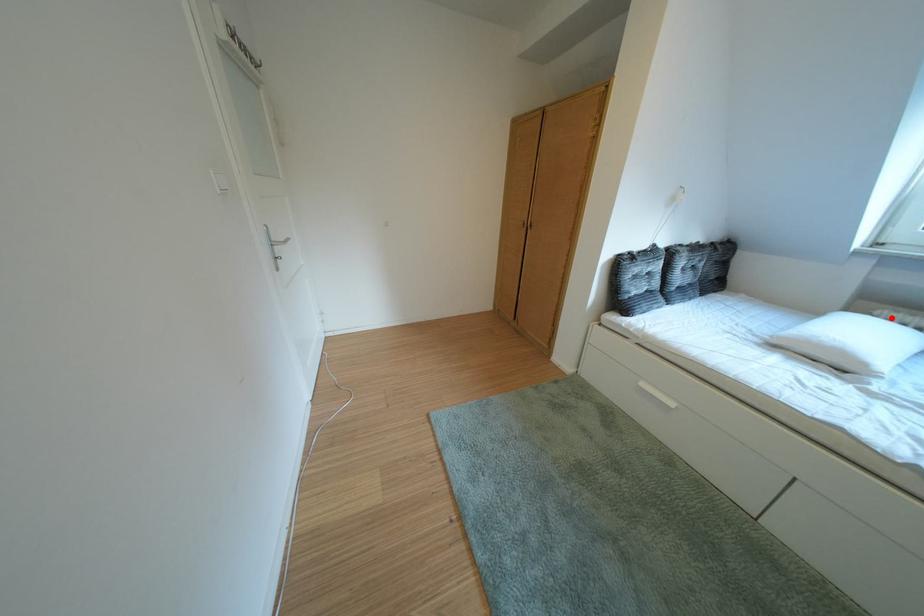
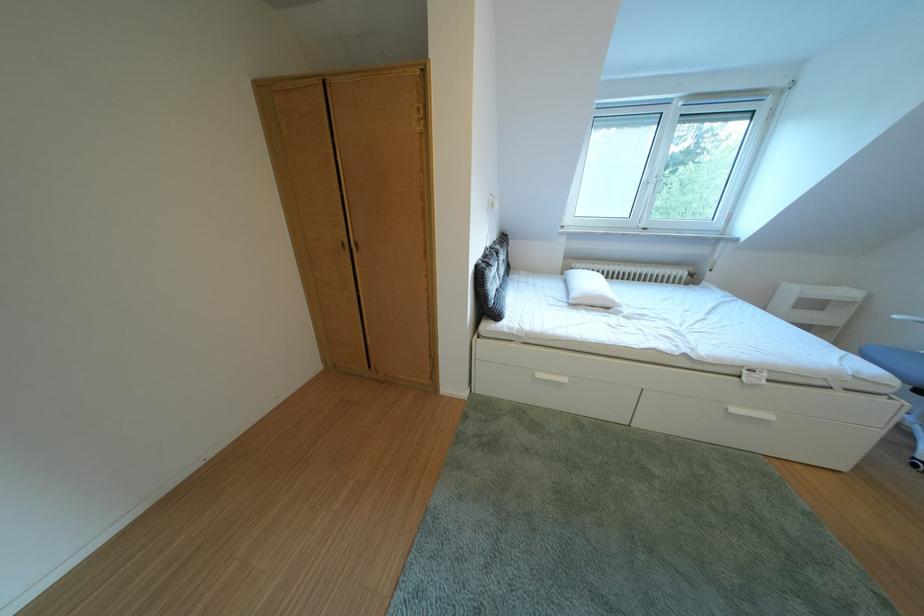
The point at the highlighted location is marked in the first image. Where is the corresponding point in the second image?

(588, 270)